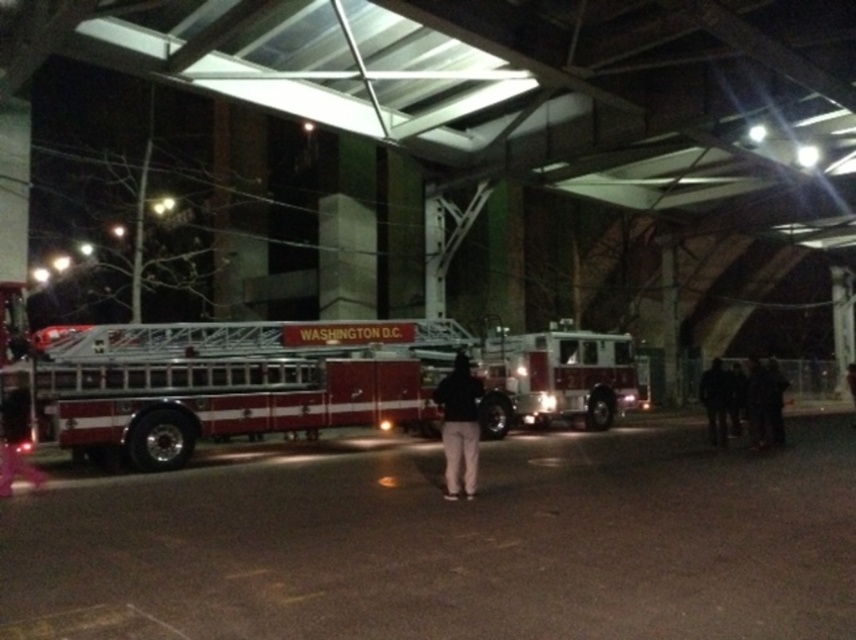
Locate an element on the screen. red/white metallic fire truck at center is located at coordinates [x=227, y=384].

Which is below, red/white metallic fire truck at center or black fabric person at lower right?

black fabric person at lower right is lower down.

Does point (302, 328) lie behind point (706, 400)?

No, it is in front of (706, 400).

In order to click on red/white metallic fire truck at center in this screenshot , I will do `click(227, 384)`.

What do you see at coordinates (459, 426) in the screenshot? I see `black matte pants at center` at bounding box center [459, 426].

Between point (477, 444) and point (767, 378), which one is positioned in front?

Positioned in front is point (477, 444).

The height and width of the screenshot is (640, 856). What do you see at coordinates (459, 426) in the screenshot? I see `black matte pants at center` at bounding box center [459, 426].

The width and height of the screenshot is (856, 640). In order to click on black matte pants at center in this screenshot , I will do `click(459, 426)`.

Does black matte pants at center appear under black fabric jacket at center?

No.

Between black matte pants at center and black fabric jacket at center, which one appears on the left side from the viewer's perspective?

From the viewer's perspective, black matte pants at center appears more on the left side.

Measure the distance between black matte pants at center and camera.

A distance of 9.65 meters exists between black matte pants at center and camera.

In order to click on black matte pants at center in this screenshot , I will do `click(459, 426)`.